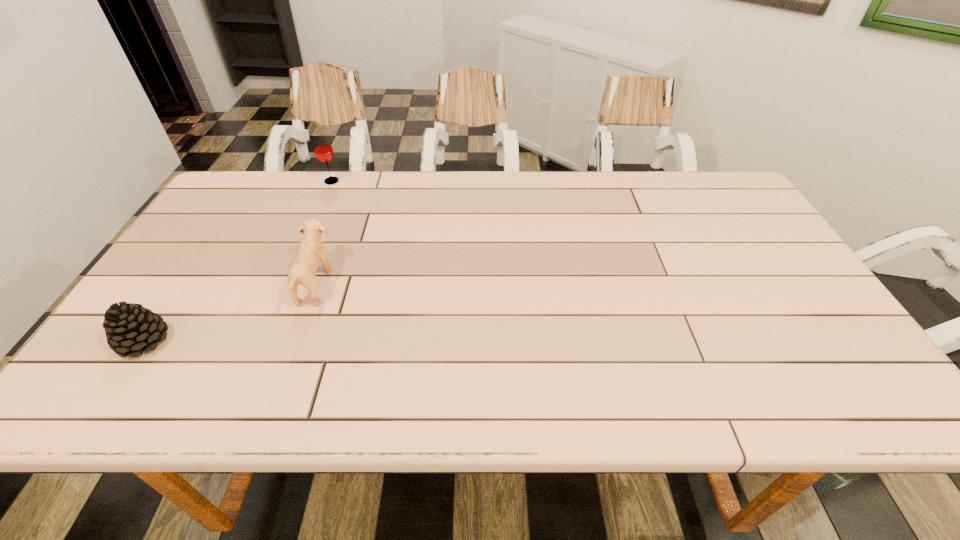
The height and width of the screenshot is (540, 960). Find the location of `the farthest object`. the farthest object is located at coordinates (323, 150).

Where is `the second object from right to left`? The width and height of the screenshot is (960, 540). the second object from right to left is located at coordinates (323, 150).

Locate an element on the screen. The width and height of the screenshot is (960, 540). the rightmost object is located at coordinates (311, 252).

This screenshot has width=960, height=540. What are the coordinates of `the shortest object` in the screenshot? It's located at (130, 328).

What are the coordinates of `pinecone` in the screenshot? It's located at 130,328.

Identify the location of free space located 0.150m on the right of the farthest object. The width and height of the screenshot is (960, 540). (387, 181).

You are a GUI agent. You are given a task and a screenshot of the screen. Output one action in this format:
    pyautogui.click(x=<x>, y=<y>)
    Task: Click on the vacant area situated 0.180m on the left side of the rightmost object
    
    Given the screenshot: What is the action you would take?
    pyautogui.click(x=400, y=286)

The height and width of the screenshot is (540, 960). I want to click on blank area located 0.390m at the narrow end of the pinecone, so click(343, 341).

I want to click on object positioned at the far edge, so click(x=323, y=150).

Locate an element on the screen. object located at the left edge is located at coordinates (130, 328).